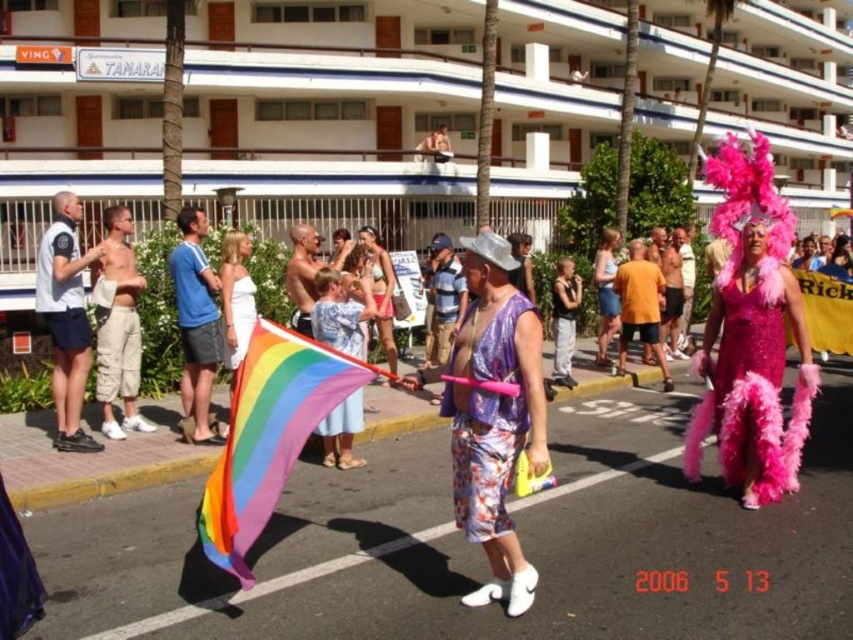
Question: Does white fabric shorts at left have a greater width compared to tan cargo shorts at left?

Choices:
 (A) yes
 (B) no

Answer: (B)

Question: Estimate the real-world distances between objects in this image. Which object is closer to the light blue cotton dress at center?

Choices:
 (A) black fabric dress at center
 (B) floral fabric shorts at center

Answer: (B)

Question: In this image, where is white fabric shorts at left located relative to light blue cotton dress at center?

Choices:
 (A) below
 (B) above

Answer: (A)

Question: Which object is closer to the camera taking this photo?

Choices:
 (A) orange cotton t-shirt at center
 (B) black fabric dress at center

Answer: (B)

Question: Does light blue cotton dress at center have a greater width compared to metallic silver hat at center?

Choices:
 (A) no
 (B) yes

Answer: (A)

Question: Estimate the real-world distances between objects in this image. Which object is closer to the floral fabric shorts at center?

Choices:
 (A) white fabric shorts at left
 (B) tan cargo shorts at left
 (C) light blue cotton dress at center
 (D) black fabric dress at center

Answer: (C)